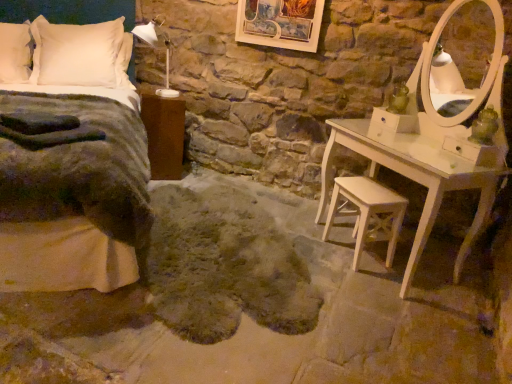
Question: Would you say white wood stool at lower right is part of wooden picture frame at upper center's contents?

Choices:
 (A) yes
 (B) no

Answer: (B)

Question: Does wooden picture frame at upper center appear on the left side of white wood stool at lower right?

Choices:
 (A) yes
 (B) no

Answer: (A)

Question: Does wooden picture frame at upper center lie behind white wood stool at lower right?

Choices:
 (A) no
 (B) yes

Answer: (B)

Question: Is wooden picture frame at upper center in front of white wood stool at lower right?

Choices:
 (A) yes
 (B) no

Answer: (B)

Question: Is wooden picture frame at upper center taller than white wood stool at lower right?

Choices:
 (A) no
 (B) yes

Answer: (A)

Question: Can you confirm if wooden picture frame at upper center is positioned to the right of white wood stool at lower right?

Choices:
 (A) yes
 (B) no

Answer: (B)

Question: Is brown wood nightstand at left far from wooden picture frame at upper center?

Choices:
 (A) yes
 (B) no

Answer: (B)

Question: Can you confirm if brown wood nightstand at left is thinner than wooden picture frame at upper center?

Choices:
 (A) yes
 (B) no

Answer: (B)

Question: From the image's perspective, is brown wood nightstand at left located above wooden picture frame at upper center?

Choices:
 (A) no
 (B) yes

Answer: (A)

Question: Is brown wood nightstand at left facing away from wooden picture frame at upper center?

Choices:
 (A) yes
 (B) no

Answer: (B)

Question: Considering the relative positions of brown wood nightstand at left and wooden picture frame at upper center in the image provided, is brown wood nightstand at left to the right of wooden picture frame at upper center from the viewer's perspective?

Choices:
 (A) yes
 (B) no

Answer: (B)

Question: Is brown wood nightstand at left in front of wooden picture frame at upper center?

Choices:
 (A) yes
 (B) no

Answer: (B)

Question: Does fuzzy gray rug at center have a smaller size compared to wooden picture frame at upper center?

Choices:
 (A) yes
 (B) no

Answer: (B)